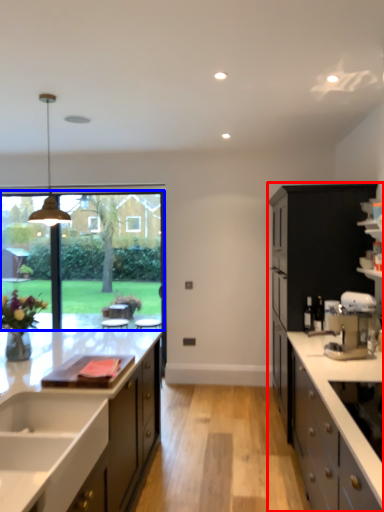
Question: Which object appears farthest to the camera in this image, cabinetry (highlighted by a red box) or window screen (highlighted by a blue box)?

Choices:
 (A) cabinetry
 (B) window screen

Answer: (B)